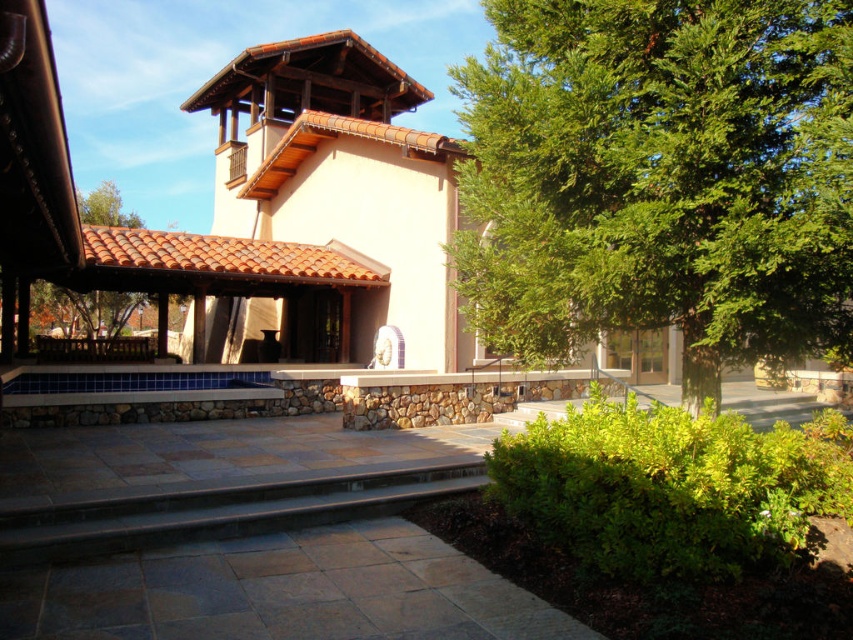
Question: Is terracotta tile gazebo at center bigger than dark gray stone stairs at lower center?

Choices:
 (A) yes
 (B) no

Answer: (A)

Question: Is green leafy tree at center bigger than terracotta tile gazebo at center?

Choices:
 (A) yes
 (B) no

Answer: (B)

Question: Considering the real-world distances, which object is farthest from the terracotta tile gazebo at center?

Choices:
 (A) dark gray stone stairs at lower center
 (B) green leafy tree at center

Answer: (B)

Question: Which point is farther from the camera taking this photo?

Choices:
 (A) 270,129
 (B) 751,236

Answer: (A)

Question: Does green leafy tree at center lie behind dark gray stone stairs at lower center?

Choices:
 (A) yes
 (B) no

Answer: (A)

Question: Which object appears farthest from the camera in this image?

Choices:
 (A) green leafy tree at center
 (B) terracotta tile gazebo at center

Answer: (B)